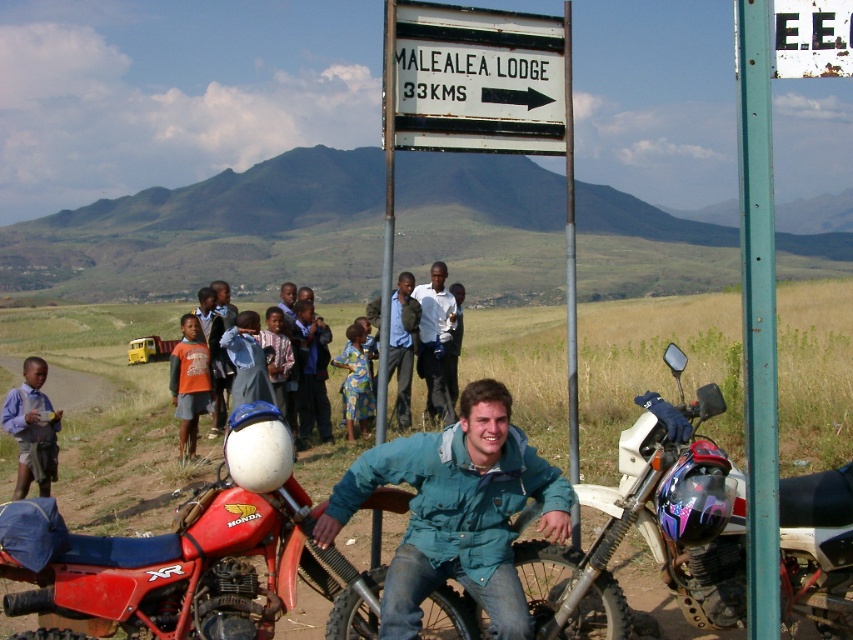
From the picture: You are a hiker trying to reach the Malealea Lodge. You see the green painted metal pole at right and the brown dirt track at lower left. According to the signpost, which direction should you head towards the lodge?

The signpost indicates that the Malealea Lodge is 33 kilometers to the right. Since the green painted metal pole at right is in front of the brown dirt track at lower left, you should head towards the direction of the green painted metal pole at right to follow the arrow pointing right towards the lodge.